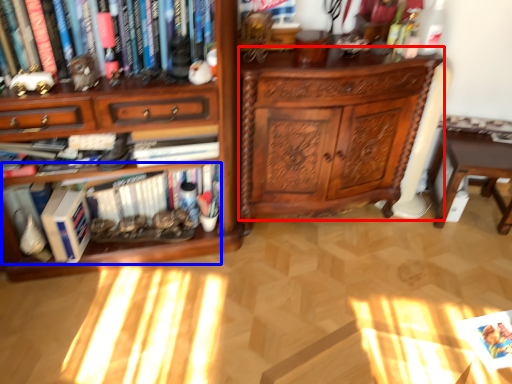
Question: Which of the following is the closest to the observer, chest of drawers (highlighted by a red box) or book (highlighted by a blue box)?

Choices:
 (A) chest of drawers
 (B) book

Answer: (A)